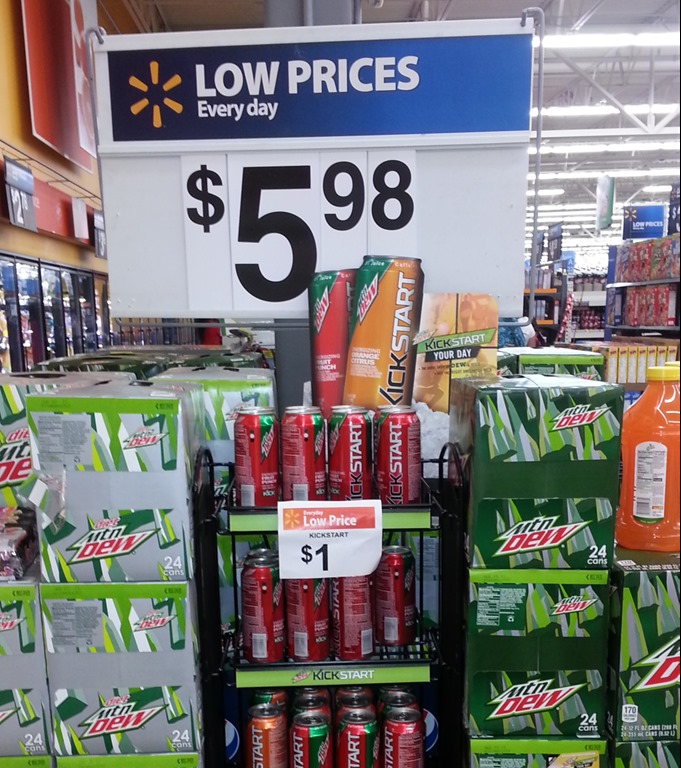
This screenshot has height=768, width=681. Identify the location of cereal boxes on shelves upper right. (661, 250).